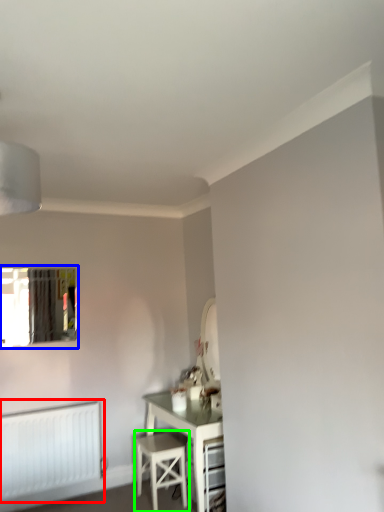
Question: Estimate the real-world distances between objects in this image. Which object is farther from radiator (highlighted by a red box), window (highlighted by a blue box) or stool (highlighted by a green box)?

Choices:
 (A) window
 (B) stool

Answer: (A)